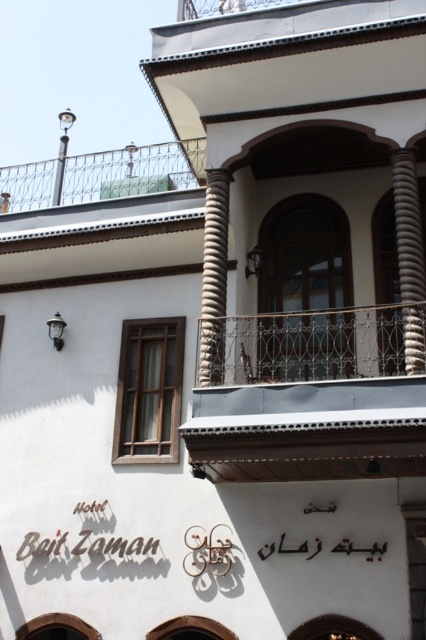
Question: Can you confirm if metallic polished balcony at center is positioned above sandy beige textured column at right?

Choices:
 (A) yes
 (B) no

Answer: (B)

Question: Is metallic polished balcony at center behind sandy beige textured column at right?

Choices:
 (A) yes
 (B) no

Answer: (B)

Question: Among these objects, which one is farthest from the camera?

Choices:
 (A) metallic polished balcony at center
 (B) sandy beige textured column at right

Answer: (B)

Question: Which object appears farthest from the camera in this image?

Choices:
 (A) metallic polished balcony at center
 (B) sandy beige textured column at right

Answer: (B)

Question: Is the position of metallic polished balcony at center more distant than that of sandy beige textured column at right?

Choices:
 (A) yes
 (B) no

Answer: (B)